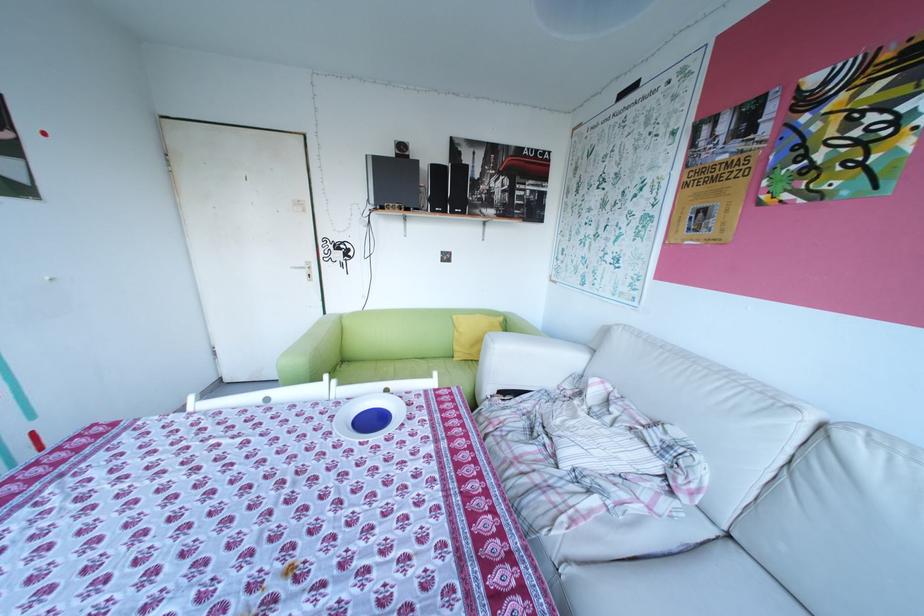
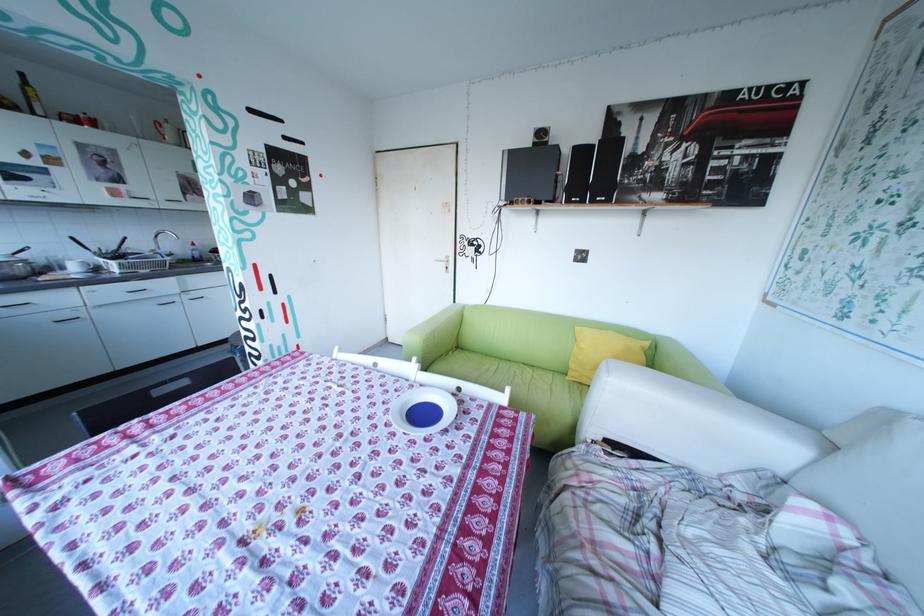
Question: The camera is either moving clockwise (left) or counter-clockwise (right) around the object. The first image is from the beginning of the video and the second image is from the end. Is the camera moving left or right when shooting the video?

Choices:
 (A) Left
 (B) Right

Answer: (B)